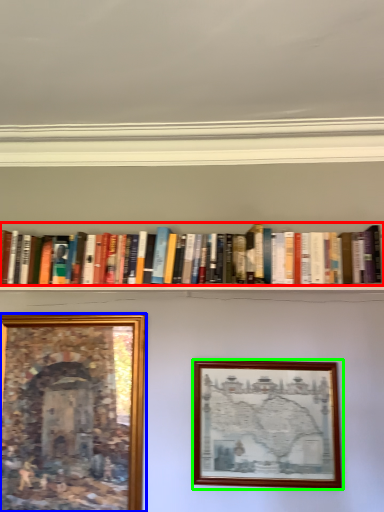
Question: Which is farther away from book (highlighted by a red box)? picture frame (highlighted by a blue box) or picture frame (highlighted by a green box)?

Choices:
 (A) picture frame
 (B) picture frame

Answer: (A)